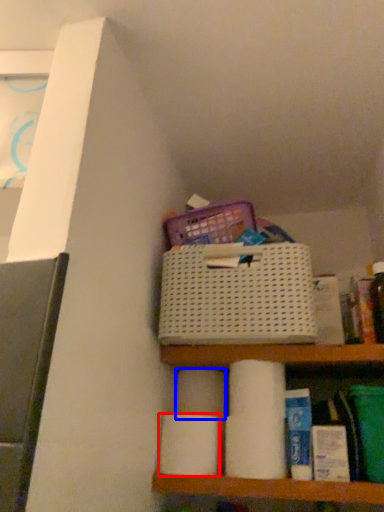
Question: Which object is further to the camera taking this photo, toilet paper (highlighted by a red box) or toilet paper (highlighted by a blue box)?

Choices:
 (A) toilet paper
 (B) toilet paper

Answer: (B)